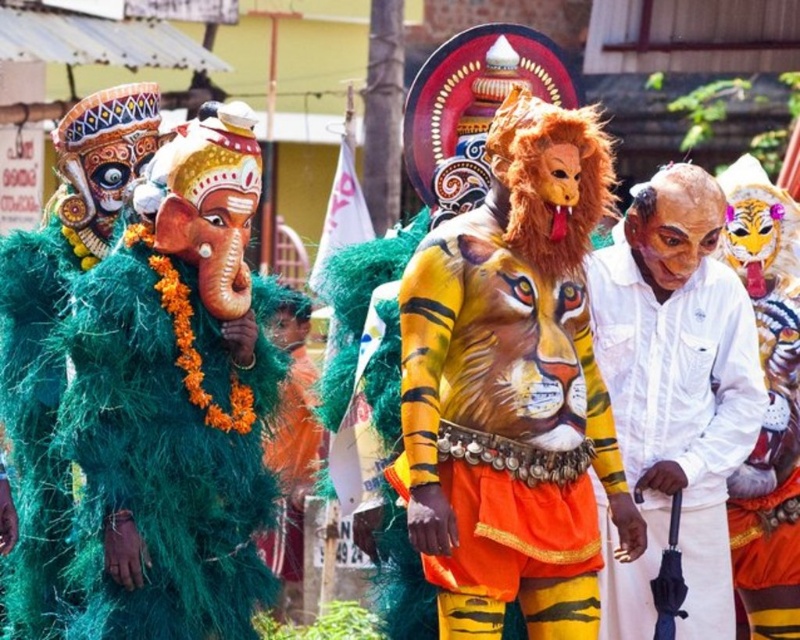
You are standing at the point labeled point (474, 257). You want to walk to the nearest performer. How far will you have to walk?

The performers are 78.73 meters apart, so the nearest performer is 39.365 meters away from the point labeled point (474, 257).

You are a photographer at the event and want to capture both the painted tiger body art at center and the white cotton shirt at center in a single frame. Which one should you position closer to the left side of your camera viewfinder to ensure both are visible?

To ensure both the painted tiger body art at center and the white cotton shirt at center are visible, position the painted tiger body art at center closer to the left side of your camera viewfinder since it is already to the left of the white cotton shirt at center in the scene.

You are standing at the center of the image and want to move towards the two points marked in the scene. Which point, point (482, 324) or point (748, 433), is closer to you?

Point (482, 324) is closer to you because it is in front of point (748, 433).